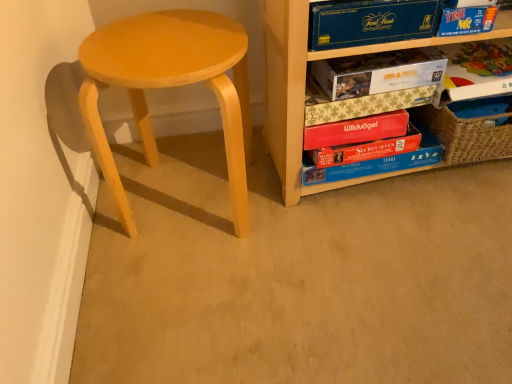
Question: Can blue cardboard puzzle box at center, marked as the 7th paperback book in a top-to-bottom arrangement, be found inside matte cardboard puzzle at upper center, which appears as the 5th paperback book when ordered from the bottom?

Choices:
 (A) yes
 (B) no

Answer: (B)

Question: From the image's perspective, would you say matte cardboard puzzle at upper center, which appears as the third paperback book when viewed from the top, is shown under blue cardboard puzzle box at center, placed as the first paperback book when sorted from bottom to top?

Choices:
 (A) no
 (B) yes

Answer: (A)

Question: Considering the relative positions of matte cardboard puzzle at upper center, which appears as the 5th paperback book when ordered from the bottom, and blue cardboard puzzle box at center, marked as the 7th paperback book in a top-to-bottom arrangement, in the image provided, is matte cardboard puzzle at upper center, which appears as the 5th paperback book when ordered from the bottom, behind blue cardboard puzzle box at center, marked as the 7th paperback book in a top-to-bottom arrangement,?

Choices:
 (A) yes
 (B) no

Answer: (B)

Question: From a real-world perspective, is matte cardboard puzzle at upper center, which appears as the 5th paperback book when ordered from the bottom, physically below blue cardboard puzzle box at center, marked as the 7th paperback book in a top-to-bottom arrangement?

Choices:
 (A) no
 (B) yes

Answer: (A)

Question: From a real-world perspective, is matte cardboard puzzle at upper center, which appears as the third paperback book when viewed from the top, positioned over blue cardboard puzzle box at center, marked as the 7th paperback book in a top-to-bottom arrangement, based on gravity?

Choices:
 (A) no
 (B) yes

Answer: (B)

Question: Is matte cardboard puzzle at upper center, which appears as the 5th paperback book when ordered from the bottom, located outside blue cardboard puzzle box at center, placed as the first paperback book when sorted from bottom to top?

Choices:
 (A) yes
 (B) no

Answer: (A)

Question: Is the position of wooden puzzle boxes at right less distant than that of matte cardboard puzzle box at center-right, the fourth paperback book from the top?

Choices:
 (A) no
 (B) yes

Answer: (B)

Question: Is wooden puzzle boxes at right thinner than matte cardboard puzzle box at center-right, which is the fourth paperback book from bottom to top?

Choices:
 (A) yes
 (B) no

Answer: (B)

Question: Can you confirm if wooden puzzle boxes at right is shorter than matte cardboard puzzle box at center-right, which is the fourth paperback book from bottom to top?

Choices:
 (A) yes
 (B) no

Answer: (B)

Question: From a real-world perspective, is wooden puzzle boxes at right located beneath matte cardboard puzzle box at center-right, which is the fourth paperback book from bottom to top?

Choices:
 (A) no
 (B) yes

Answer: (A)

Question: Is wooden puzzle boxes at right outside matte cardboard puzzle box at center-right, the fourth paperback book from the top?

Choices:
 (A) yes
 (B) no

Answer: (A)

Question: Can you confirm if wooden puzzle boxes at right is positioned to the right of matte cardboard puzzle box at center-right, the fourth paperback book from the top?

Choices:
 (A) yes
 (B) no

Answer: (A)

Question: Is matte cardboard puzzle box at center-right, the fourth paperback book from the top, taller than red matte wildvögel book at center, the 3th paperback book ordered from the bottom?

Choices:
 (A) yes
 (B) no

Answer: (B)